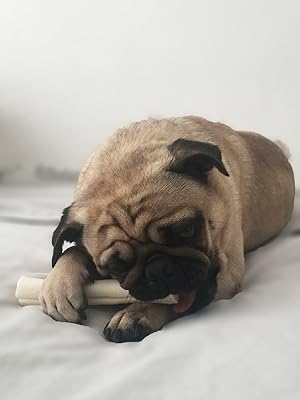
The width and height of the screenshot is (300, 400). Identify the location of wall, white. (110, 73).